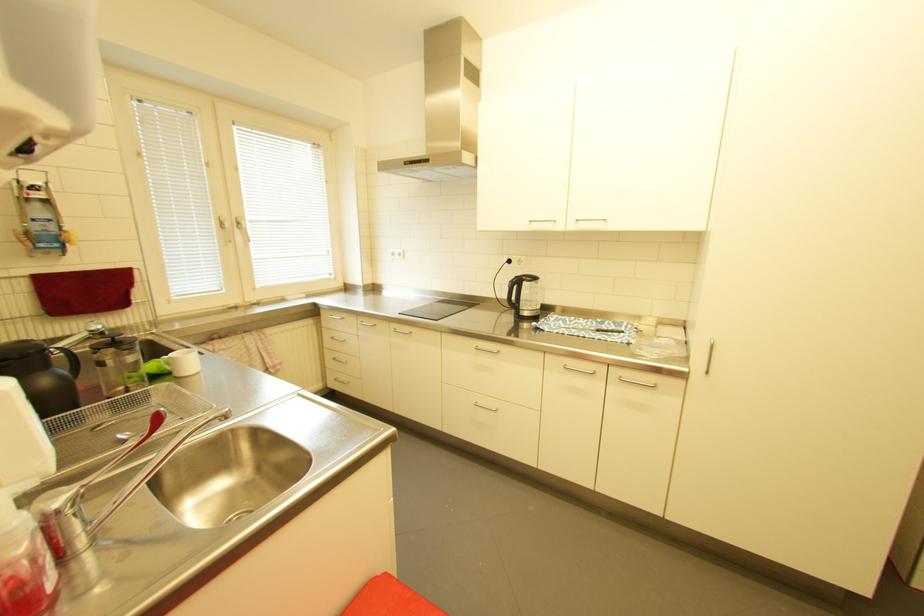
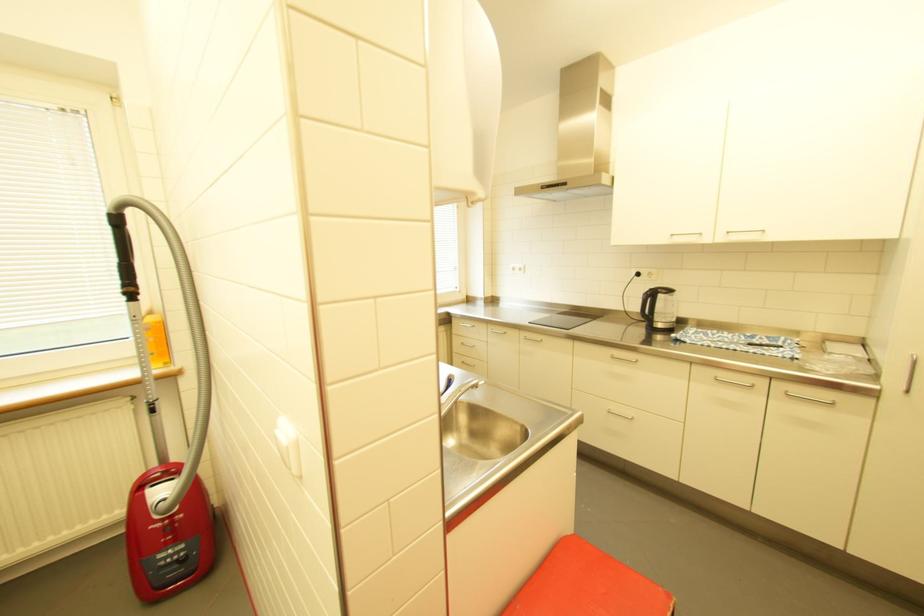
Where in the second image is the point corresponding to [585,221] from the first image?

(736, 233)